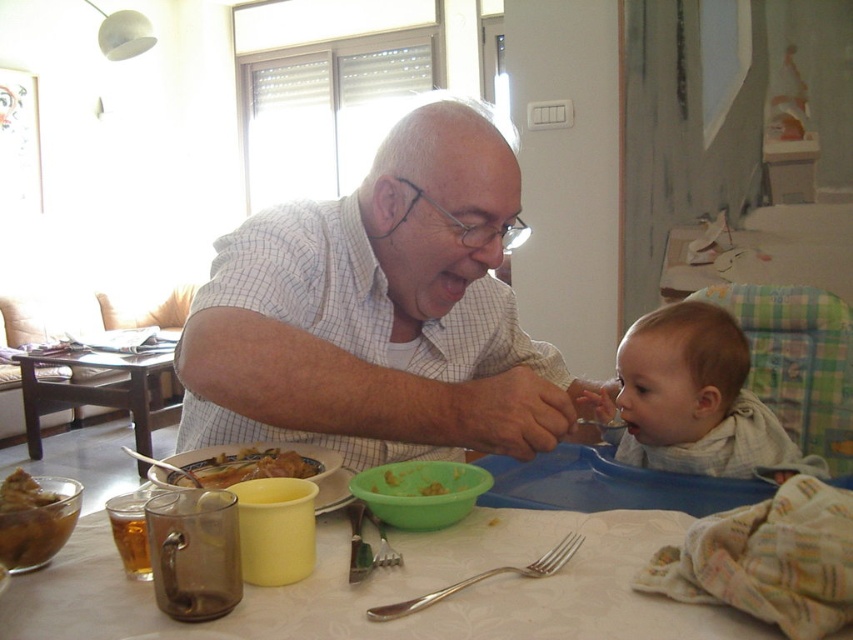
Question: Based on their relative distances, which object is farther from the satin silver fork at table center?

Choices:
 (A) yellow rubbery food at center
 (B) golden brown bread at center
 (C) white textured tablecloth at center
 (D) white checkered shirt at center

Answer: (D)

Question: Does light brown fabric baby at lower right have a smaller size compared to yellow rubbery food at center?

Choices:
 (A) yes
 (B) no

Answer: (B)

Question: Where is white checkered shirt at center located in relation to satin silver fork at table center in the image?

Choices:
 (A) right
 (B) left

Answer: (B)

Question: Estimate the real-world distances between objects in this image. Which object is farther from the brown matte soup at lower left?

Choices:
 (A) satin silver fork at table center
 (B) golden brown bread at center

Answer: (A)

Question: In this image, where is brown matte soup at lower left located relative to golden brown bread at center?

Choices:
 (A) below
 (B) above

Answer: (A)

Question: Considering the real-world distances, which object is closest to the yellow rubbery food at center?

Choices:
 (A) golden brown bread at center
 (B) brown matte soup at lower left
 (C) white textured tablecloth at center
 (D) wooden table at center

Answer: (A)